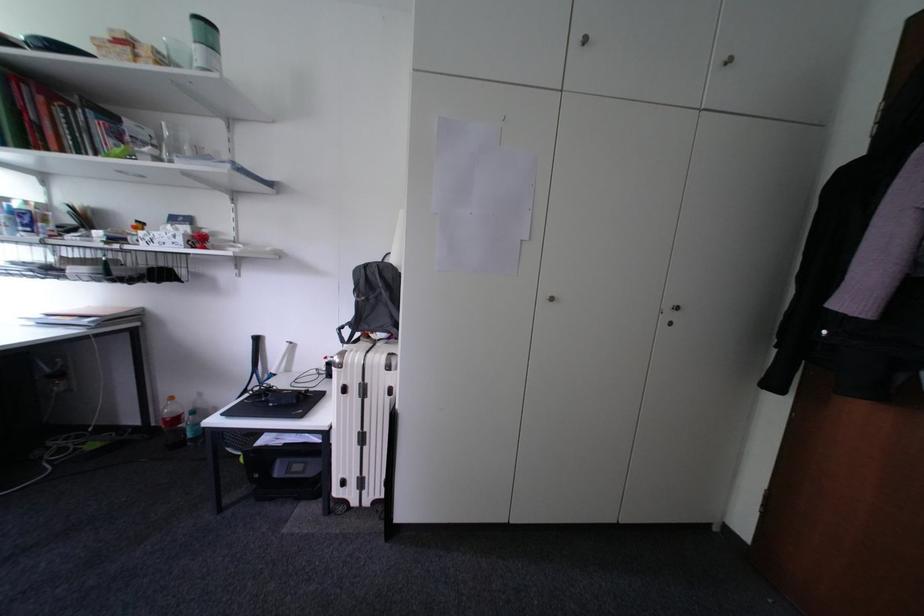
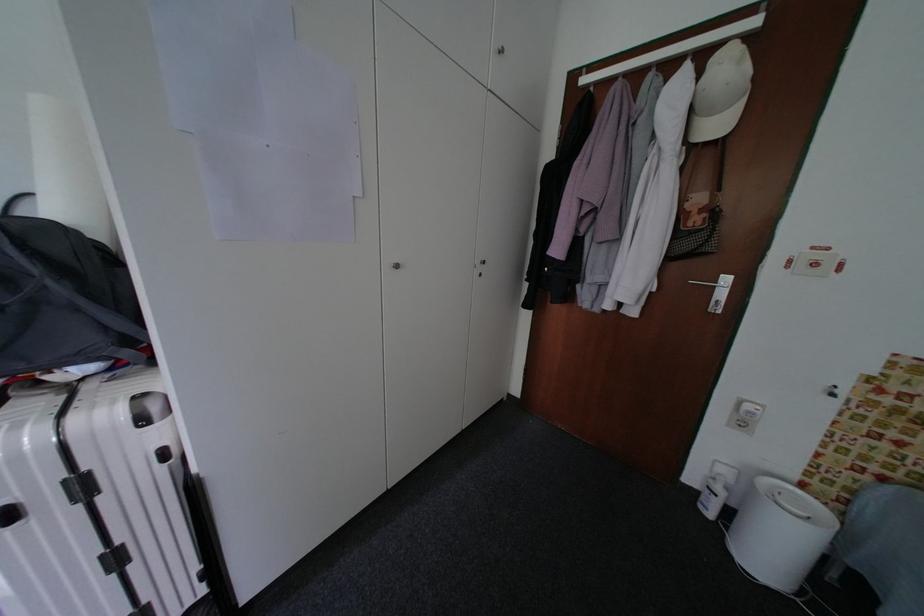
Question: The images are taken continuously from a first-person perspective. In which direction is your viewpoint rotating?

Choices:
 (A) Left
 (B) Right
 (C) Up
 (D) Down

Answer: (B)